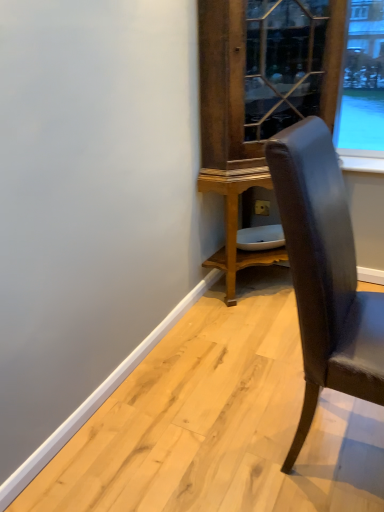
Image resolution: width=384 pixels, height=512 pixels. I want to click on blank area to the left of leather chair at right, so click(200, 435).